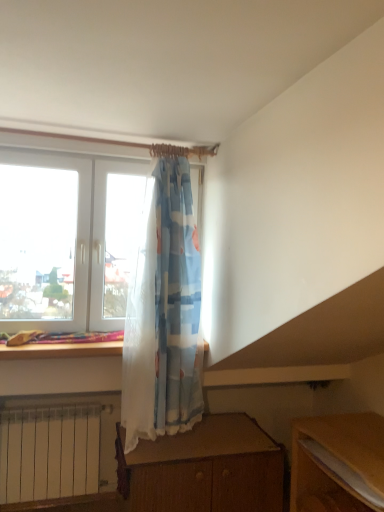
Question: Looking at their shapes, would you say wooden table at lower right is wider or thinner than wooden desk at lower center?

Choices:
 (A) wide
 (B) thin

Answer: (B)

Question: From a real-world perspective, is wooden table at lower right above or below wooden desk at lower center?

Choices:
 (A) below
 (B) above

Answer: (B)

Question: In terms of height, does wooden table at lower right look taller or shorter compared to wooden desk at lower center?

Choices:
 (A) short
 (B) tall

Answer: (A)

Question: Considering their positions, is wooden desk at lower center located in front of or behind wooden table at lower right?

Choices:
 (A) behind
 (B) front

Answer: (A)

Question: In terms of height, does wooden desk at lower center look taller or shorter compared to wooden table at lower right?

Choices:
 (A) short
 (B) tall

Answer: (B)

Question: From the image's perspective, relative to wooden table at lower right, is wooden desk at lower center above or below?

Choices:
 (A) above
 (B) below

Answer: (B)

Question: From a real-world perspective, is wooden desk at lower center physically located above or below wooden table at lower right?

Choices:
 (A) below
 (B) above

Answer: (A)